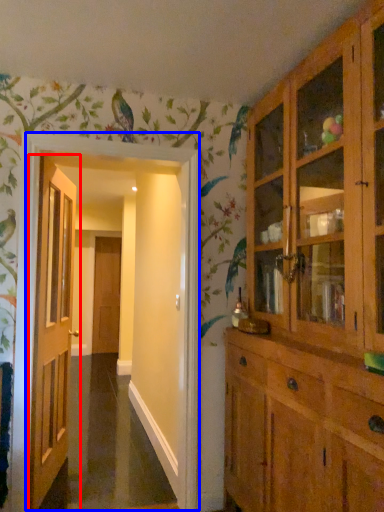
Question: Which of the following is the farthest to the observer, door (highlighted by a red box) or corridor (highlighted by a blue box)?

Choices:
 (A) door
 (B) corridor

Answer: (A)